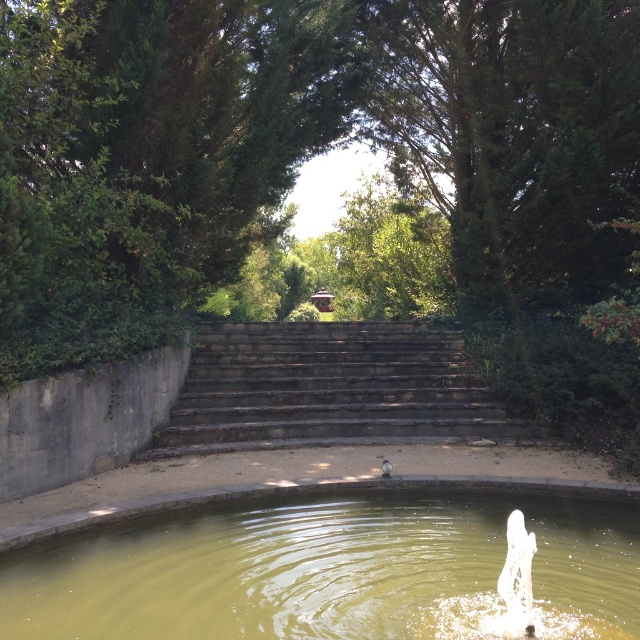
You are a maintenance worker tasked with checking the height of the greenish water at center and the dark gray stone stairs at center. Which one has a lower height?

The greenish water at center is shorter than the dark gray stone stairs at center, so the greenish water at center has a lower height.